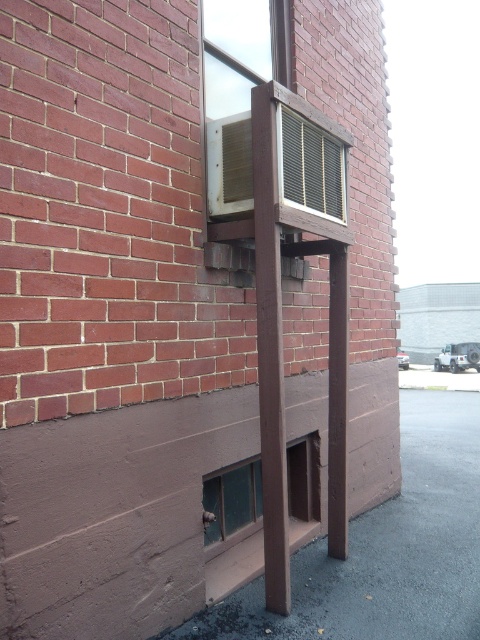
You are standing in front of the brick building and want to locate the metallic grid window at upper center and the green glass window at lower left. Based on their positions, which window is positioned more to the right side?

The metallic grid window at upper center is positioned more to the right side compared to the green glass window at lower left.

Based on the photo, you are standing in front of the brick building and notice two points marked on the wall. The first point is at coordinates point (211, 152) and the second is at point (289, 184). Which point is closer to you?

Point (289, 184) is closer to you because it is in front of point (211, 152).